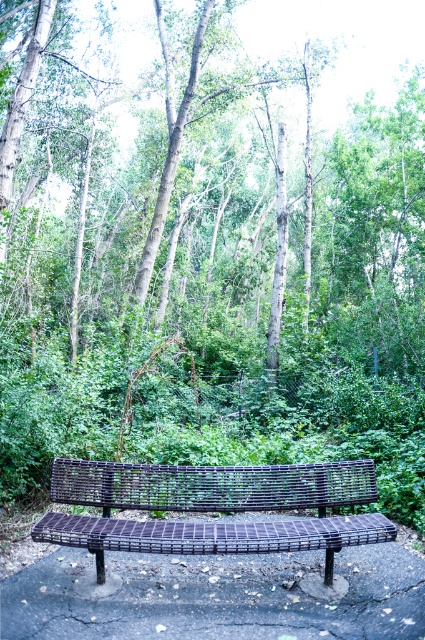
Is green leafy tree at center thinner than metallic woven bench at center?

In fact, green leafy tree at center might be wider than metallic woven bench at center.

In the scene shown: Is green leafy tree at center above metallic woven bench at center?

Yes.

Is point (224, 129) farther from camera compared to point (206, 477)?

Yes, it is behind point (206, 477).

Image resolution: width=425 pixels, height=640 pixels. Find the location of `green leafy tree at center`. green leafy tree at center is located at coordinates (207, 198).